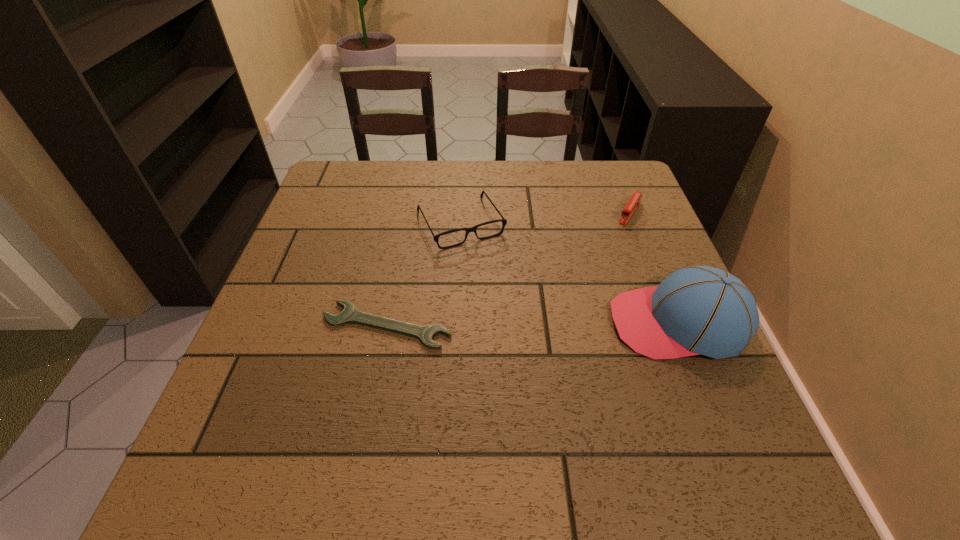
Find the location of a particular element. This screenshot has width=960, height=540. free point located 0.310m on the front-facing side of the stapler is located at coordinates (581, 300).

This screenshot has width=960, height=540. In order to click on free space located 0.390m on the front-facing side of the spectacles in this screenshot , I will do `click(551, 380)`.

This screenshot has height=540, width=960. I want to click on free region located on the front-facing side of the spectacles, so click(519, 325).

Find the location of a particular element. This screenshot has height=540, width=960. free space located on the front-facing side of the spectacles is located at coordinates (554, 384).

Image resolution: width=960 pixels, height=540 pixels. Find the location of `stapler at the far edge`. stapler at the far edge is located at coordinates (630, 208).

What are the coordinates of `spectacles located in the far edge section of the desktop` in the screenshot? It's located at (473, 229).

Where is `object positioned at the left edge`? object positioned at the left edge is located at coordinates (350, 315).

This screenshot has height=540, width=960. Find the location of `baseball cap at the right edge`. baseball cap at the right edge is located at coordinates (695, 310).

You are a GUI agent. You are given a task and a screenshot of the screen. Output one action in this format:
    pyautogui.click(x=<x>, y=<y>)
    Task: Click on the stapler located at the right edge
    
    Given the screenshot: What is the action you would take?
    pyautogui.click(x=630, y=208)

In order to click on object that is at the far right corner in this screenshot , I will do `click(630, 208)`.